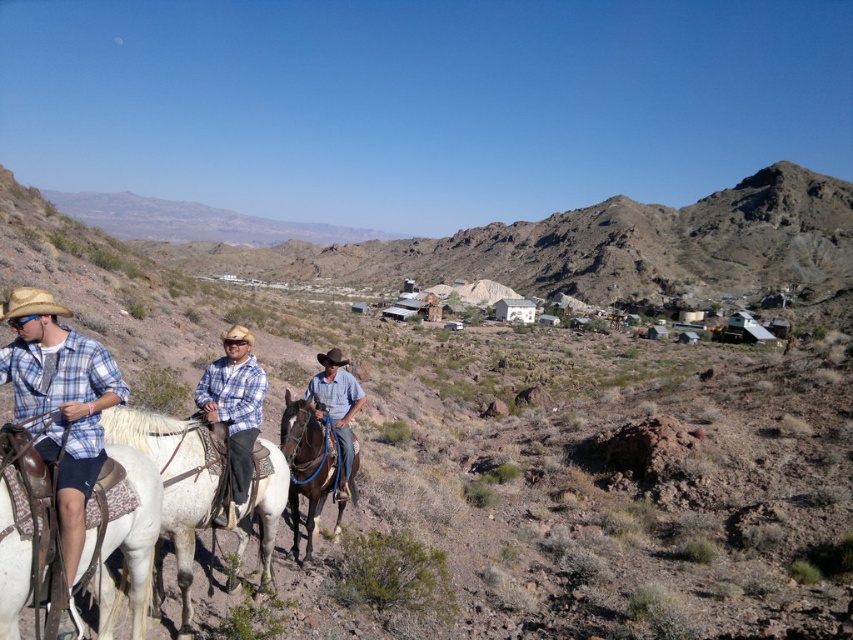
You are a photographer trying to capture the scene with a wide angle lens. You have to decide whether the plaid shirt at center will be in the frame if you focus on the point marked by point (234, 412). Can you confirm?

The plaid shirt at center is represented by point (234, 412), so focusing on that point will center the plaid shirt at center in the frame.

You are standing in the desert and want to reach a specific point marked at coordinates point (236, 333). If your maximum walking distance is 15 meters, can you reach that point without exceeding your limit?

The distance of point (236, 333) from viewer is 15.61 meters, so you cannot reach it without exceeding your 15 meter limit.

From the picture: You are a photographer trying to capture a photo of the desert scene. You want to ensure both the white matte horse at left and the brown glossy horse at center are visible in the frame. Based on their positions, which horse should you position closer to the left edge of your camera viewfinder?

The white matte horse at left is positioned to the left of the brown glossy horse at center, so you should place the white matte horse at left closer to the left edge of the camera viewfinder to include both in the frame.